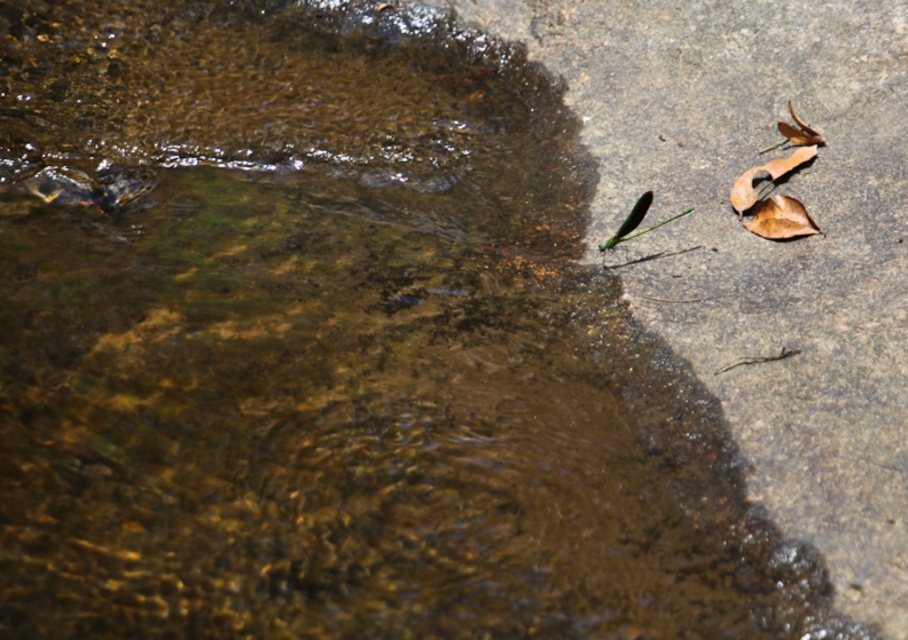
You are standing at the center of the stream and see a point marked at coordinates (780, 218). What object is located at this point?

The point at coordinates (780, 218) corresponds to a brown dry leaf at right.